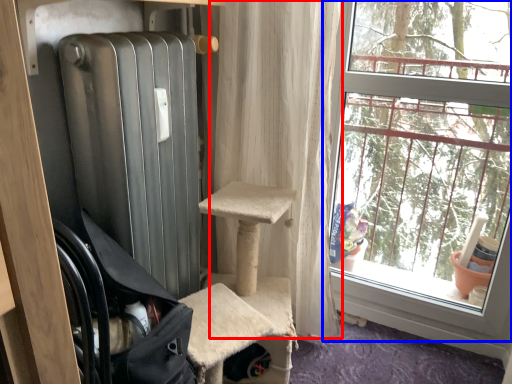
Question: Among these objects, which one is nearest to the camera, curtain (highlighted by a red box) or window (highlighted by a blue box)?

Choices:
 (A) curtain
 (B) window

Answer: (B)